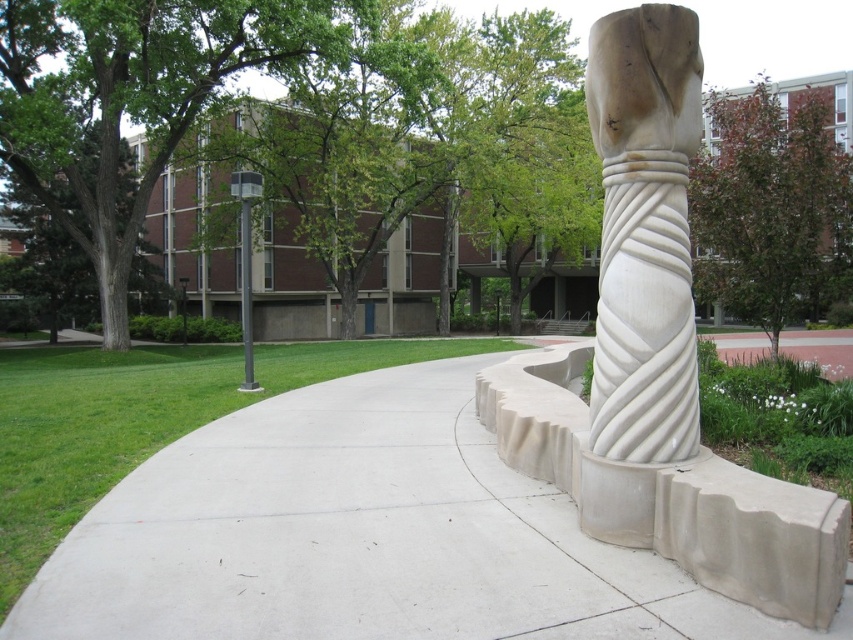
Question: Which of the following is the closest to the observer?

Choices:
 (A) metallic pole at upper left
 (B) white marble column at center

Answer: (B)

Question: Considering the real-world distances, which object is closest to the white marble column at center?

Choices:
 (A) white concrete pavement at center
 (B) metallic pole at upper left

Answer: (A)

Question: Is white concrete pavement at center to the left of white marble column at center from the viewer's perspective?

Choices:
 (A) yes
 (B) no

Answer: (A)

Question: From the image, what is the correct spatial relationship of white concrete pavement at center in relation to metallic pole at upper left?

Choices:
 (A) right
 (B) left

Answer: (A)

Question: Which object is the closest to the white marble column at center?

Choices:
 (A) metallic pole at upper left
 (B) white concrete pavement at center

Answer: (B)

Question: Does white concrete pavement at center have a larger size compared to white marble column at center?

Choices:
 (A) no
 (B) yes

Answer: (A)